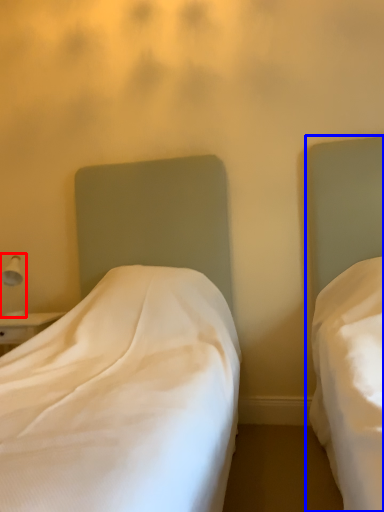
Question: Among these objects, which one is farthest to the camera, bedside lamp (highlighted by a red box) or bed (highlighted by a blue box)?

Choices:
 (A) bedside lamp
 (B) bed

Answer: (A)